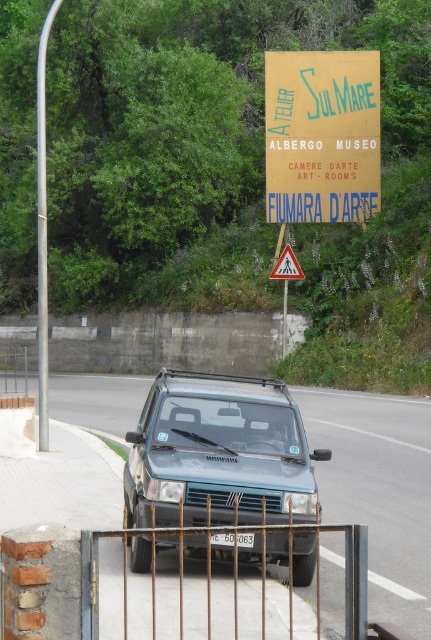
You are a tour guide leading a group to the entrance of Atelier Sul Mare. You have a teal matte suv at center and a rusty metal gate at lower center in your view. Which object is larger in size?

The teal matte suv at center is smaller than the rusty metal gate at lower center, so the rusty metal gate at lower center is larger in size.

You are a tour guide explaining the entrance of Atelier Sul Mare to visitors. Pointing to the teal matte suv at center and the wooden signboard at upper center, you want to highlight their sizes. Which object is larger?

The wooden signboard at upper center is larger than the teal matte suv at center.